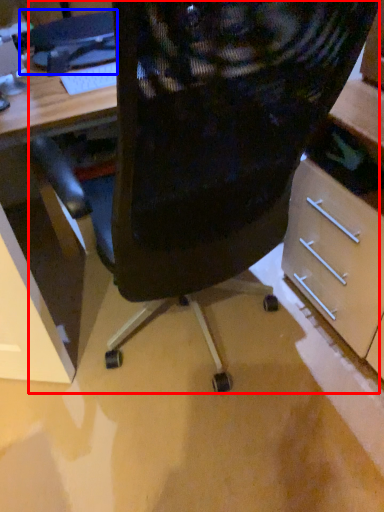
Question: Which object is further to the camera taking this photo, chair (highlighted by a red box) or computer (highlighted by a blue box)?

Choices:
 (A) chair
 (B) computer

Answer: (B)